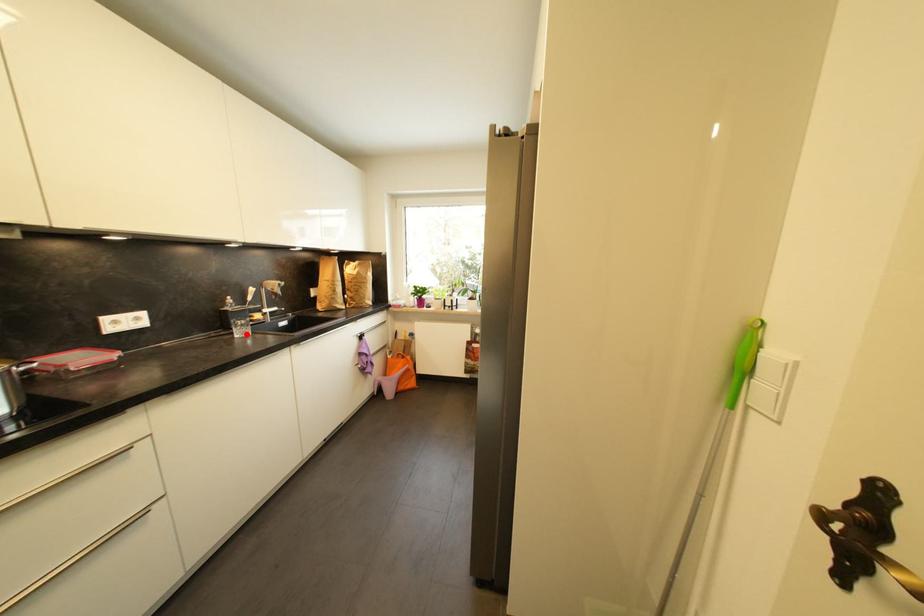
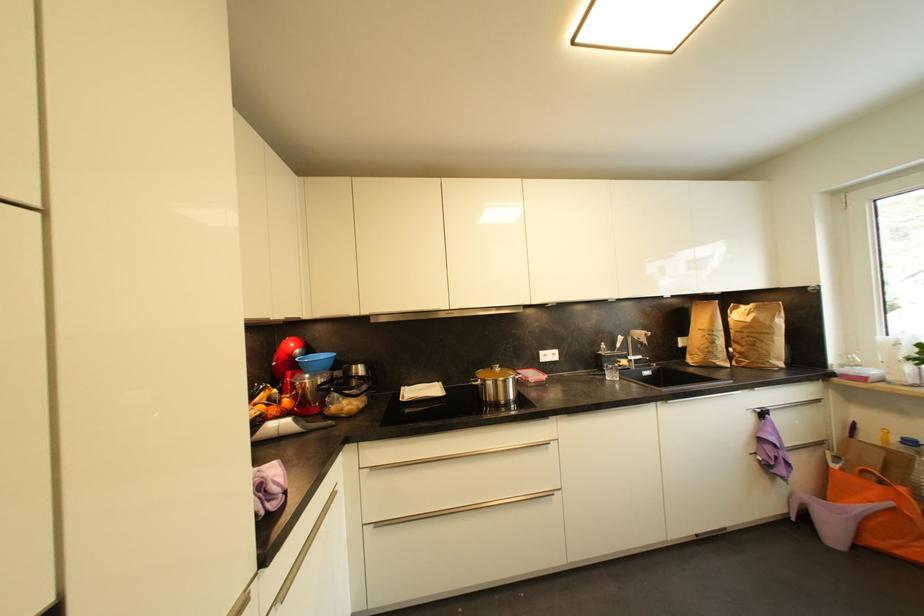
Question: A red point is marked in image1. In image2, is the corresponding 3D point closer to the camera or farther? Reply with the corresponding letter.

Choices:
 (A) The corresponding 3D point is closer.
 (B) The corresponding 3D point is farther.

Answer: (B)